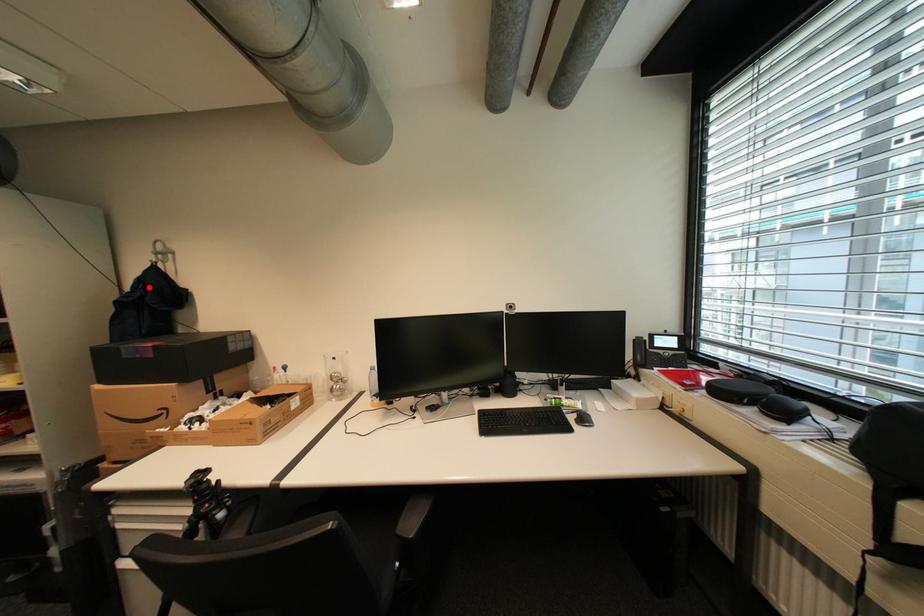
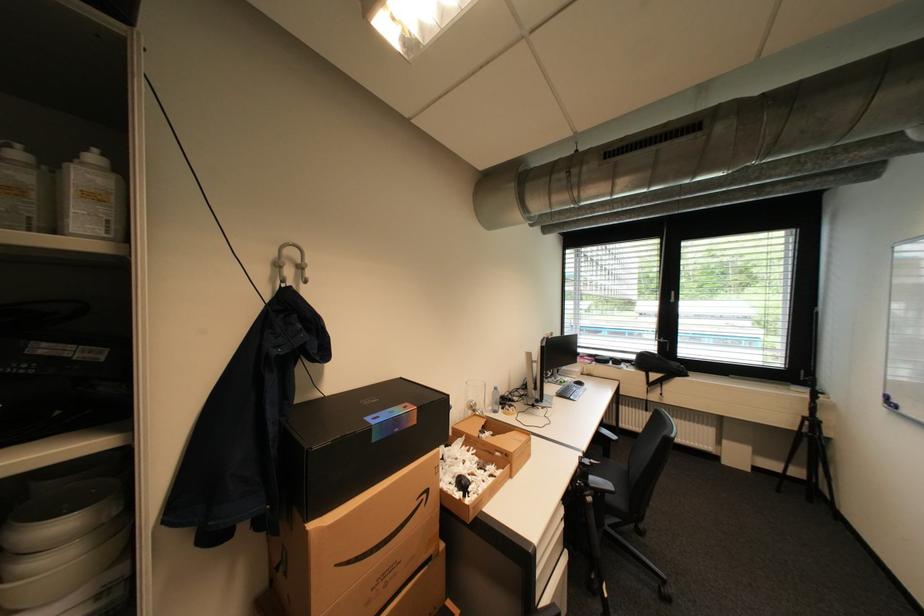
In the second image, find the point that corresponds to the highlighted location in the first image.

(309, 326)